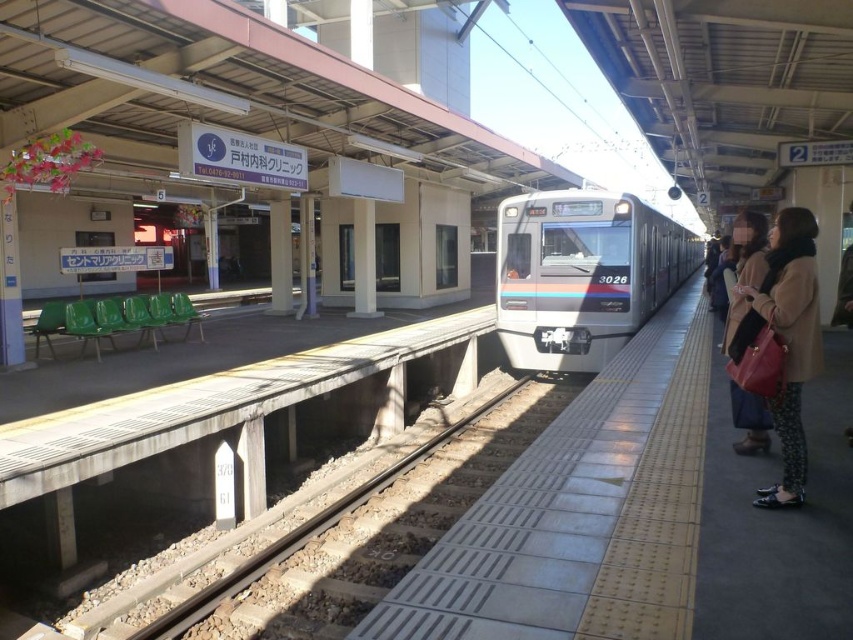
You are a passenger waiting at the train station platform. You notice the beige wool coat at right and the brown leather handbag at right. Which object is closer to the edge of the platform?

The beige wool coat at right is positioned on the left side of brown leather handbag at right. Since the platform edge is on the right side, the brown leather handbag at right is closer to the edge.

You are a delivery robot with a box that is 1.5 meters long. You need to place the box between the beige wool coat at right and the brown leather handbag at right on the platform. Is there enough space for the box to fit between them?

The beige wool coat at right is 1.35 meters from the brown leather handbag at right. Since the box is 1.5 meters long, it is longer than the available space between them, so the box cannot fit between the beige wool coat at right and the brown leather handbag at right.